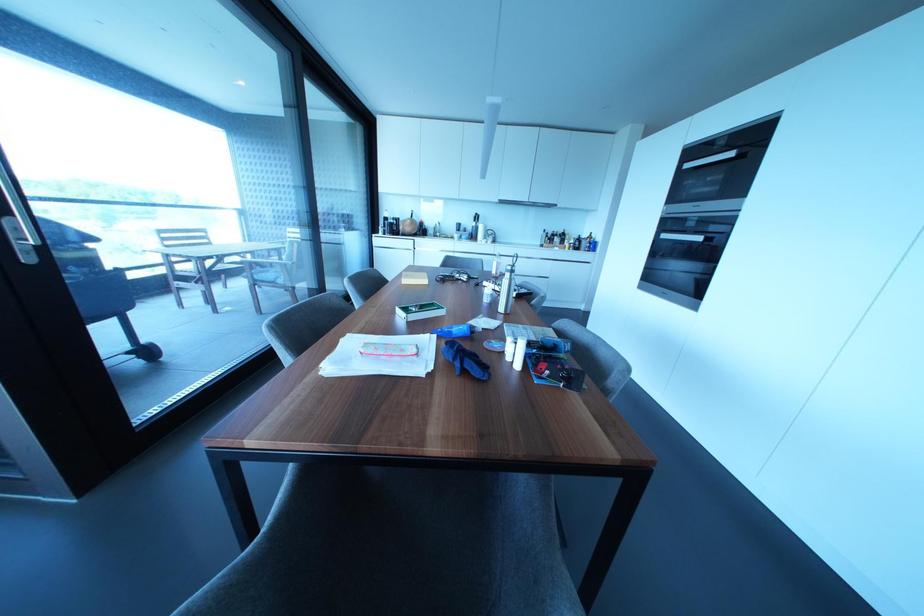
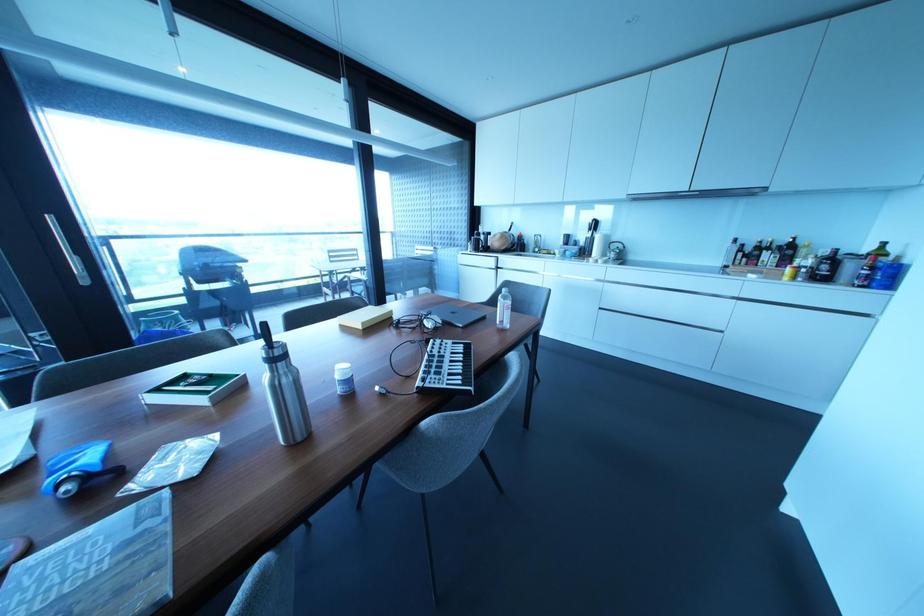
Locate, in the second image, the point that corresponds to the point at 511,276 in the first image.

(273, 369)